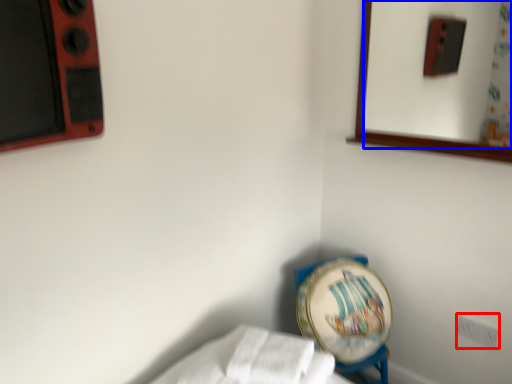
Question: Which point is further to the camera, electric outlet (highlighted by a red box) or mirror (highlighted by a blue box)?

Choices:
 (A) electric outlet
 (B) mirror

Answer: (A)